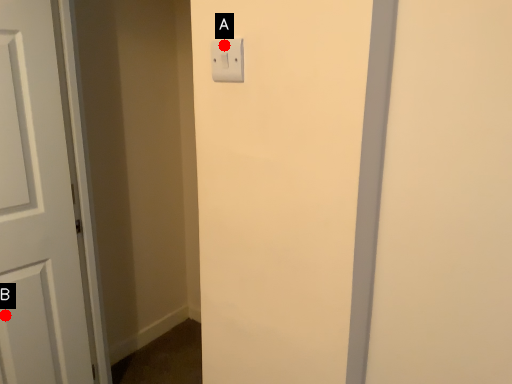
Question: Two points are circled on the image, labeled by A and B beside each circle. Which of the following is the farthest from the observer?

Choices:
 (A) A is further
 (B) B is further

Answer: (B)